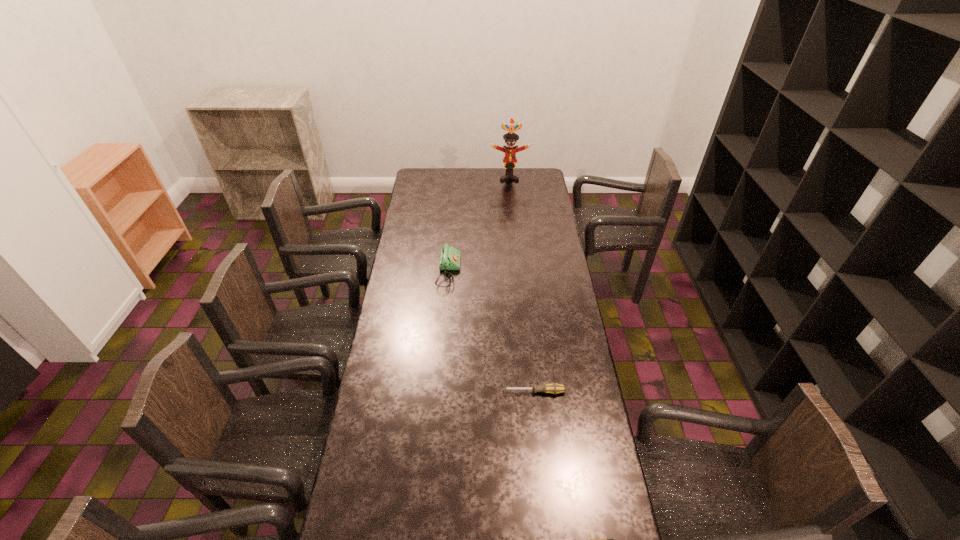
Locate an element on the screen. The width and height of the screenshot is (960, 540). empty space between the farthest object and the taller screwdriver is located at coordinates (521, 285).

The image size is (960, 540). What are the coordinates of `empty space that is in between the leftmost object and the farthest object` in the screenshot? It's located at (479, 225).

Locate an element on the screen. The height and width of the screenshot is (540, 960). vacant space in between the telephone and the tallest object is located at coordinates (479, 225).

Find the location of a particular element. This screenshot has width=960, height=540. object that stands as the second closest to the second shortest object is located at coordinates (449, 257).

You are a GUI agent. You are given a task and a screenshot of the screen. Output one action in this format:
    pyautogui.click(x=<x>, y=<y>)
    Task: Click on the object that stands as the closest to the nearer screwdriver
    Image resolution: width=960 pixels, height=540 pixels.
    Given the screenshot: What is the action you would take?
    click(x=554, y=388)

Find the location of a particular element. The image size is (960, 540). vacant space that satisfies the following two spatial constraints: 1. on the front-facing side of the nutcracker; 2. on the dial of the telephone is located at coordinates (518, 272).